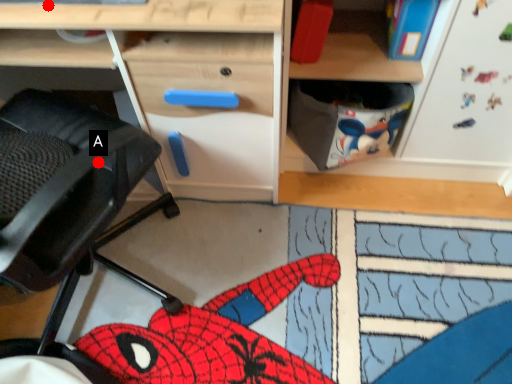
Question: Two points are circled on the image, labeled by A and B beside each circle. Which point is farther from the camera taking this photo?

Choices:
 (A) A is further
 (B) B is further

Answer: (B)